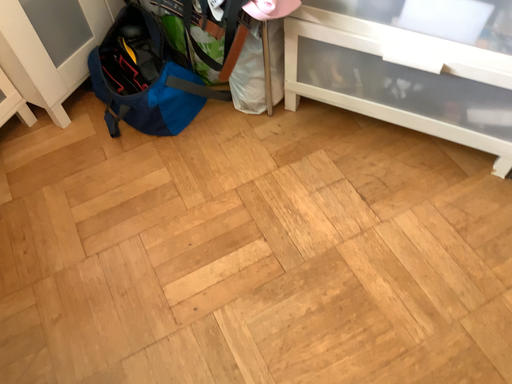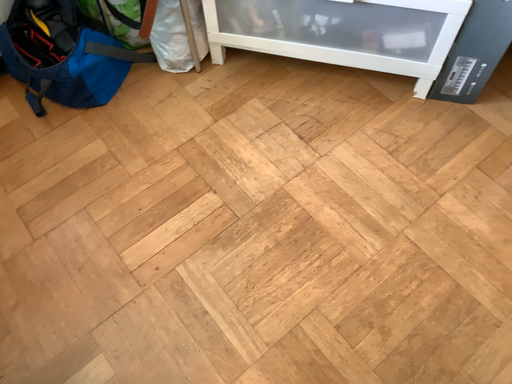
Question: Which way did the camera rotate in the video?

Choices:
 (A) rotated right
 (B) rotated left

Answer: (A)